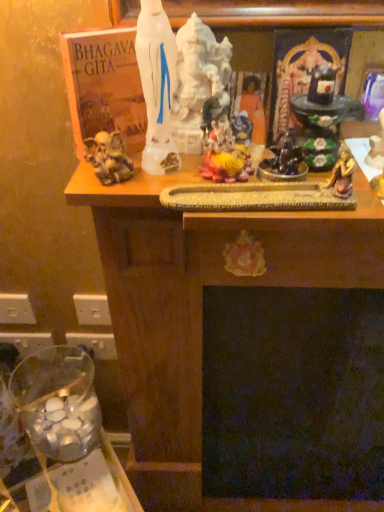
Find the location of a particular element. white glossy statue at upper center is located at coordinates (157, 86).

What do you see at coordinates (253, 108) in the screenshot? I see `matte orange statue at center` at bounding box center [253, 108].

At what (x,y) coordinates should I click in order to perform the action: click on matte orange statue at center. Please return your answer as a coordinate pair (x, y). Looking at the image, I should click on (253, 108).

Locate an element on the screen. clear glass jar at lower left is located at coordinates (58, 402).

Consider the image. Does matte orange statue at center have a smaller size compared to white glossy statue at upper center?

Yes.

Which of these two, matte orange statue at center or white glossy statue at upper center, is thinner?

matte orange statue at center.

Is point (243, 95) farther from camera compared to point (144, 160)?

Yes.

Considering their positions, is matte orange statue at center located in front of or behind clear glass jar at lower left?

Visually, matte orange statue at center is located in front of clear glass jar at lower left.

Can you tell me how much matte orange statue at center and clear glass jar at lower left differ in facing direction?

The angular difference between matte orange statue at center and clear glass jar at lower left is 69.3 degrees.

Who is smaller, matte orange statue at center or clear glass jar at lower left?

Smaller between the two is matte orange statue at center.

Between point (241, 99) and point (92, 381), which one is positioned behind?

The point (92, 381) is more distant.

Is white glossy statue at upper center not close to matte orange statue at center?

No, there isn't a large distance between white glossy statue at upper center and matte orange statue at center.

Who is bigger, white glossy statue at upper center or matte orange statue at center?

Bigger between the two is white glossy statue at upper center.

Between point (149, 44) and point (250, 104), which one is positioned behind?

The point (250, 104) is more distant.

From a real-world perspective, which is physically below, white glossy statue at upper center or matte orange statue at center?

matte orange statue at center, from a real-world perspective.

Which object is positioned more to the right, white glossy statue at upper center or clear glass jar at lower left?

From the viewer's perspective, white glossy statue at upper center appears more on the right side.

Is white glossy statue at upper center outside of clear glass jar at lower left?

Yes.

How different are the orientations of white glossy statue at upper center and clear glass jar at lower left in degrees?

They differ by 54.6 degrees in their facing directions.

Which of these two, clear glass jar at lower left or matte orange statue at center, is bigger?

With larger size is clear glass jar at lower left.

From the image's perspective, is clear glass jar at lower left located above matte orange statue at center?

No.

Which of these two, clear glass jar at lower left or matte orange statue at center, stands shorter?

Standing shorter between the two is matte orange statue at center.

From a real-world perspective, relative to matte orange statue at center, is clear glass jar at lower left vertically above or below?

In terms of real-world spatial position, clear glass jar at lower left is below matte orange statue at center.

From the image's perspective, is clear glass jar at lower left above or below white glossy statue at upper center?

clear glass jar at lower left is below white glossy statue at upper center.

Considering the sizes of clear glass jar at lower left and white glossy statue at upper center in the image, is clear glass jar at lower left bigger or smaller than white glossy statue at upper center?

Considering their sizes, clear glass jar at lower left takes up more space than white glossy statue at upper center.

Is point (61, 430) positioned behind point (147, 169)?

Yes, it is.

The image size is (384, 512). I want to click on person that appears below the white glossy statue at upper center (from the image's perspective), so click(x=253, y=108).

In order to click on person above the clear glass jar at lower left (from the image's perspective) in this screenshot , I will do `click(253, 108)`.

Considering their positions, is white glossy statue at upper center positioned closer to matte orange statue at center than clear glass jar at lower left?

white glossy statue at upper center is closer to matte orange statue at center.

Estimate the real-world distances between objects in this image. Which object is closer to white glossy statue at upper center, clear glass jar at lower left or matte orange statue at center?

matte orange statue at center lies closer to white glossy statue at upper center than the other object.

Estimate the real-world distances between objects in this image. Which object is further from clear glass jar at lower left, matte orange statue at center or white glossy statue at upper center?

Based on the image, matte orange statue at center appears to be further to clear glass jar at lower left.

Looking at the image, which one is located further to clear glass jar at lower left, white glossy statue at upper center or matte orange statue at center?

Among the two, matte orange statue at center is located further to clear glass jar at lower left.

Estimate the real-world distances between objects in this image. Which object is further from white glossy statue at upper center, matte orange statue at center or clear glass jar at lower left?

Among the two, clear glass jar at lower left is located further to white glossy statue at upper center.

Looking at the image, which one is located further to matte orange statue at center, clear glass jar at lower left or white glossy statue at upper center?

Among the two, clear glass jar at lower left is located further to matte orange statue at center.

I want to click on person between white glossy statue at upper center and clear glass jar at lower left from top to bottom, so click(x=253, y=108).